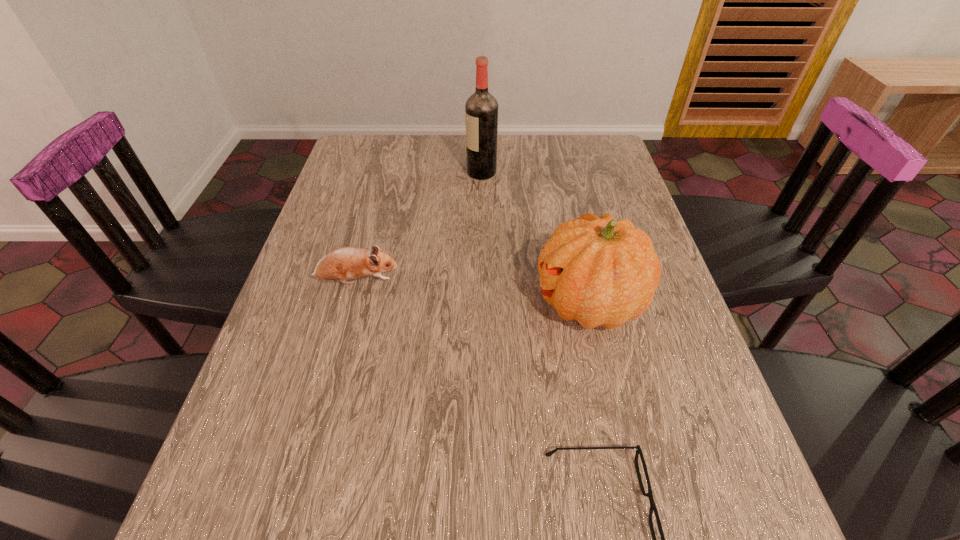
The image size is (960, 540). Find the location of `vacant area situated 0.370m on the carved face of the second tallest object`. vacant area situated 0.370m on the carved face of the second tallest object is located at coordinates 367,302.

What are the coordinates of `vacant area situated 0.400m at the face of the second shortest object` in the screenshot? It's located at (572, 282).

The width and height of the screenshot is (960, 540). I want to click on object situated at the far edge, so click(481, 109).

You are a GUI agent. You are given a task and a screenshot of the screen. Output one action in this format:
    pyautogui.click(x=<x>, y=<y>)
    Task: Click on the object located at the left edge
    This screenshot has width=960, height=540.
    Given the screenshot: What is the action you would take?
    pyautogui.click(x=344, y=263)

This screenshot has width=960, height=540. Identify the location of object located in the right edge section of the desktop. (598, 271).

What are the coordinates of `free space at the far edge of the desktop` in the screenshot? It's located at (551, 158).

This screenshot has height=540, width=960. What are the coordinates of `vacant region at the near edge of the desktop` in the screenshot? It's located at (363, 523).

The width and height of the screenshot is (960, 540). Find the location of `vacant space at the left edge`. vacant space at the left edge is located at coordinates (248, 489).

The image size is (960, 540). I want to click on blank space at the right edge, so click(x=678, y=335).

Identify the location of free spot at the far left corner of the desktop. (359, 160).